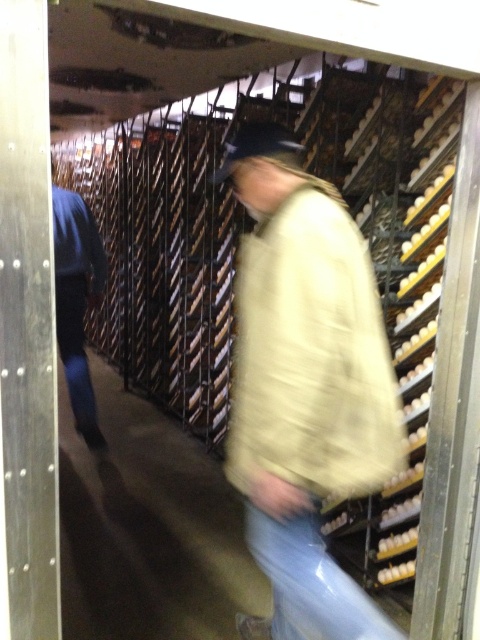
You are an inspector visiting the poultry farm. You notice a worker wearing a beige woolen jacket at center and blue denim jeans at left. Which part of their clothing has a greater horizontal span when viewed from your perspective?

The beige woolen jacket at center has a greater horizontal span than the blue denim jeans at left, as its width surpasses that of the jeans.

You are an inspector visiting the poultry farm and need to ensure safety standards are met. You notice the beige woolen jacket at center and the blue denim jeans at left. Which item is taller in the image?

The beige woolen jacket at center is taller than the blue denim jeans at left according to the description.